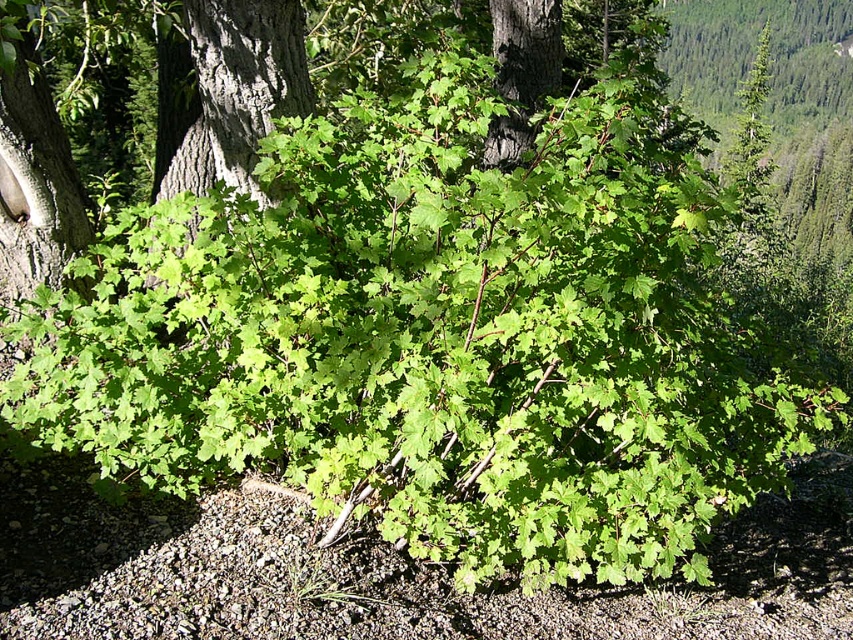
Question: Can you confirm if smooth gray bark at center is positioned to the left of dark brown bark at center?

Choices:
 (A) no
 (B) yes

Answer: (B)

Question: Which of the following is the closest to the observer?

Choices:
 (A) dark brown bark at center
 (B) smooth gray bark at center

Answer: (B)

Question: Does smooth gray bark at center have a greater width compared to dark brown bark at center?

Choices:
 (A) yes
 (B) no

Answer: (A)

Question: Is the position of smooth gray bark at center less distant than that of dark brown bark at center?

Choices:
 (A) yes
 (B) no

Answer: (A)

Question: Which of the following is the closest to the observer?

Choices:
 (A) (543, 36)
 (B) (258, 22)

Answer: (B)